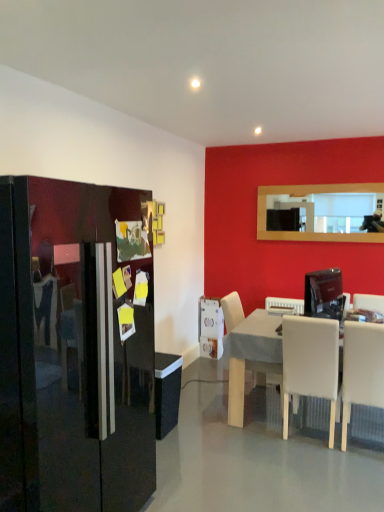
Question: In which direction should I rotate to look at white leather chair at center, which is counted as the 3th chair, starting from the right?

Choices:
 (A) left
 (B) right

Answer: (B)

Question: Does satin black monitor at right, marked as the first appliance in a right-to-left arrangement, come in front of white matte chair at lower right, the 2th chair viewed from the left?

Choices:
 (A) no
 (B) yes

Answer: (A)

Question: Is satin black monitor at right, which is the 3th appliance from bottom to top, oriented away from white matte chair at lower right, the 2th chair viewed from the left?

Choices:
 (A) no
 (B) yes

Answer: (A)

Question: Can you confirm if satin black monitor at right, which is the 3th appliance from back to front, is wider than white matte chair at lower right, the 2th chair viewed from the left?

Choices:
 (A) no
 (B) yes

Answer: (A)

Question: Does satin black monitor at right, the third appliance viewed from the left, have a larger size compared to white matte chair at lower right, which appears as the second chair when viewed from the right?

Choices:
 (A) no
 (B) yes

Answer: (A)

Question: Is satin black monitor at right, marked as the first appliance in a right-to-left arrangement, surrounding white matte chair at lower right, the 2th chair viewed from the left?

Choices:
 (A) yes
 (B) no

Answer: (B)

Question: Does satin black monitor at right, marked as the first appliance in a right-to-left arrangement, have a greater height compared to white matte chair at lower right, the 2th chair viewed from the left?

Choices:
 (A) no
 (B) yes

Answer: (A)

Question: Is white leather chair at center, which is the 1th chair in left-to-right order, smaller than white matte table at center?

Choices:
 (A) no
 (B) yes

Answer: (B)

Question: From a real-world perspective, is white leather chair at center, which is counted as the 3th chair, starting from the right, positioned over white matte table at center based on gravity?

Choices:
 (A) yes
 (B) no

Answer: (A)

Question: Considering the relative positions of white leather chair at center, which is counted as the 3th chair, starting from the right, and white matte table at center in the image provided, is white leather chair at center, which is counted as the 3th chair, starting from the right, in front of white matte table at center?

Choices:
 (A) no
 (B) yes

Answer: (A)

Question: Considering the relative sizes of white leather chair at center, which is the 1th chair in left-to-right order, and white matte table at center in the image provided, is white leather chair at center, which is the 1th chair in left-to-right order, wider than white matte table at center?

Choices:
 (A) no
 (B) yes

Answer: (A)

Question: From a real-world perspective, is white leather chair at center, which is the 1th chair in left-to-right order, physically below white matte table at center?

Choices:
 (A) yes
 (B) no

Answer: (B)

Question: Is white matte table at center a part of white leather chair at center, which is counted as the 3th chair, starting from the right?

Choices:
 (A) yes
 (B) no

Answer: (B)

Question: Is glossy black refrigerator at left thinner than white matte table at center?

Choices:
 (A) no
 (B) yes

Answer: (B)